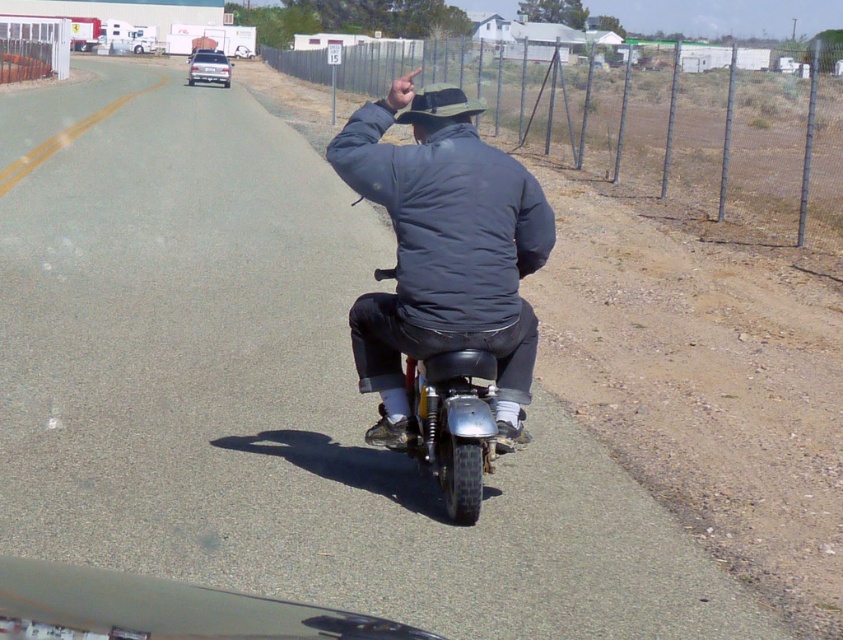
Question: Is matte black motorcycle at center to the right of dark gray puffy jacket at center from the viewer's perspective?

Choices:
 (A) no
 (B) yes

Answer: (B)

Question: Does matte black motorcycle at center appear on the right side of dark gray puffy jacket at center?

Choices:
 (A) no
 (B) yes

Answer: (B)

Question: Which point is closer to the camera taking this photo?

Choices:
 (A) (422, 253)
 (B) (459, 237)
 (C) (468, 524)

Answer: (B)

Question: Does dark gray puffy jacket at center come behind shiny chrome motorcycle at center?

Choices:
 (A) no
 (B) yes

Answer: (B)

Question: Among these objects, which one is nearest to the camera?

Choices:
 (A) shiny chrome motorcycle at center
 (B) dark gray puffy jacket at center
 (C) matte black motorcycle at center

Answer: (A)

Question: Which of the following is the farthest from the observer?

Choices:
 (A) (405, 282)
 (B) (420, 284)

Answer: (A)